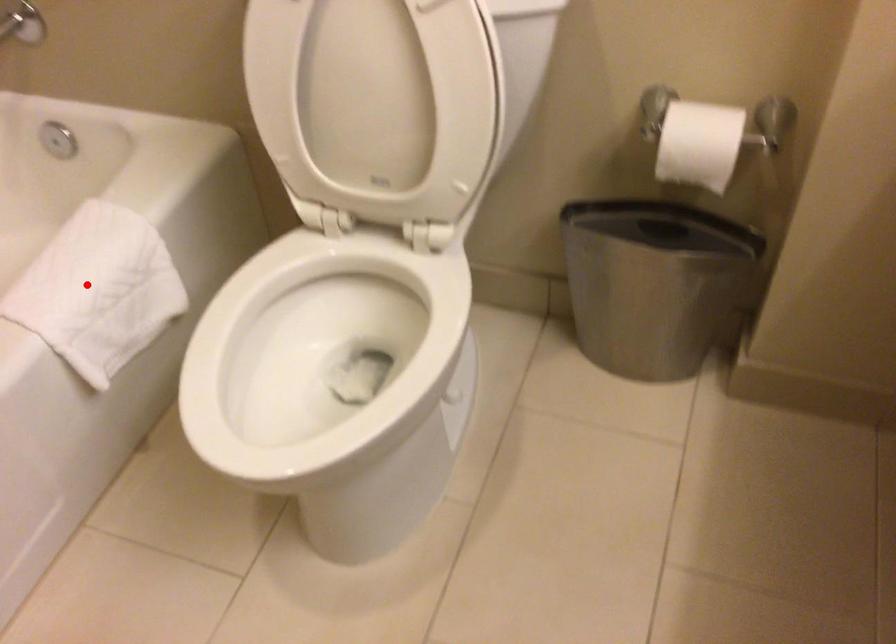
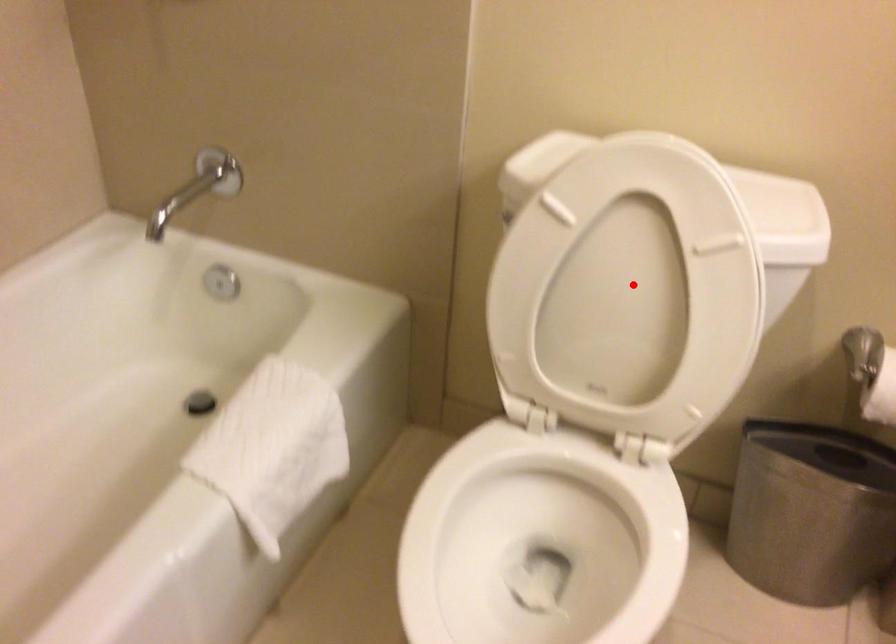
I am providing you with two images of the same scene from different viewpoints. A red point is marked on the first image and another point is marked on the second image. Do the highlighted points in image1 and image2 indicate the same real-world spot?

No